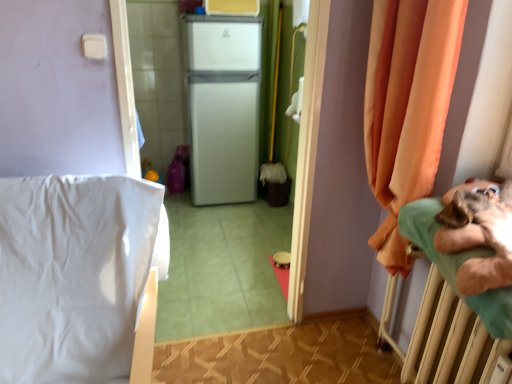
The image size is (512, 384). I want to click on free space in front of white matte refrigerator at center, so click(223, 219).